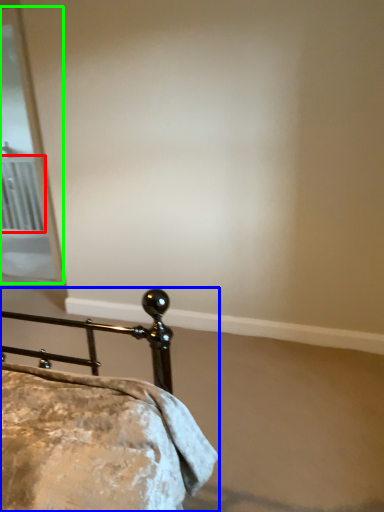
Question: Estimate the real-world distances between objects in this image. Which object is closer to radiator (highlighted by a red box), bed (highlighted by a blue box) or screen door (highlighted by a green box)?

Choices:
 (A) bed
 (B) screen door

Answer: (B)